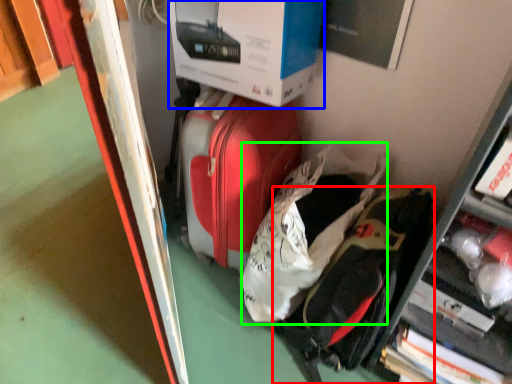
Question: Estimate the real-world distances between objects in this image. Which object is closer to backpack (highlighted by a red box), box (highlighted by a blue box) or luggage (highlighted by a green box)?

Choices:
 (A) box
 (B) luggage

Answer: (B)